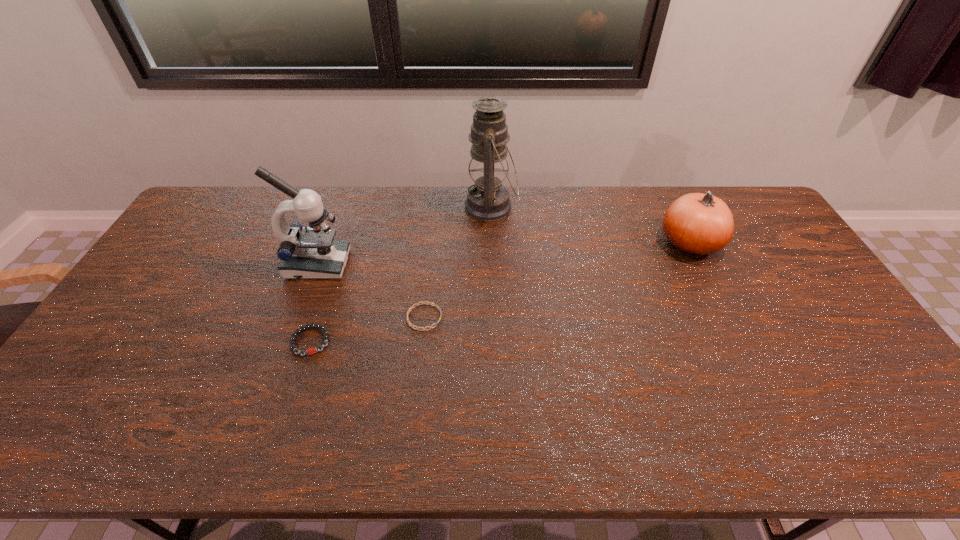
At what (x,y) coordinates should I click in order to perform the action: click on free space between the pumpkin and the second shortest object. Please return your answer as a coordinate pair (x, y). The image size is (960, 540). Looking at the image, I should click on (500, 292).

In order to click on vacant region between the pumpkin and the microscope in this screenshot , I will do `click(503, 253)`.

You are a GUI agent. You are given a task and a screenshot of the screen. Output one action in this format:
    pyautogui.click(x=<x>, y=<y>)
    Task: Click on the empty space that is in between the oil lamp and the second shortest object
    This screenshot has height=540, width=960.
    Given the screenshot: What is the action you would take?
    pyautogui.click(x=400, y=274)

In order to click on blank region between the pumpkin and the shorter bracelet in this screenshot , I will do `click(557, 280)`.

Find the location of a particular element. free point between the oil lamp and the rightmost object is located at coordinates (590, 225).

Find the location of a particular element. This screenshot has width=960, height=540. free space that is in between the pumpkin and the taller bracelet is located at coordinates (500, 292).

At what (x,y) coordinates should I click in order to perform the action: click on vacant point located between the pumpkin and the shortest object. Please return your answer as a coordinate pair (x, y). Looking at the image, I should click on [x=557, y=280].

At what (x,y) coordinates should I click in order to perform the action: click on vacant region between the left bracelet and the microscope. Please return your answer as a coordinate pair (x, y). Looking at the image, I should click on (314, 303).

I want to click on vacant point located between the microscope and the fourth object from left to right, so click(x=404, y=235).

The width and height of the screenshot is (960, 540). Identify the location of unoccupied area between the fourth tallest object and the microscope. (314, 303).